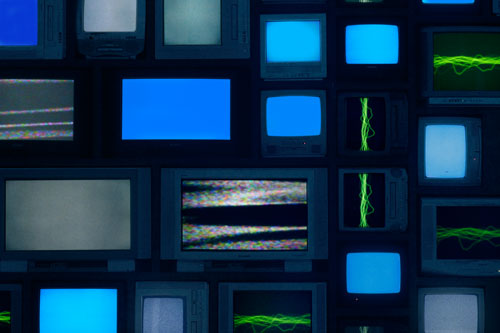
This screenshot has width=500, height=333. What are the coordinates of `built in vhs/dvd` in the screenshot? It's located at (52, 24), (106, 48), (232, 25), (297, 70), (380, 73), (393, 197), (394, 124), (72, 260), (245, 267).